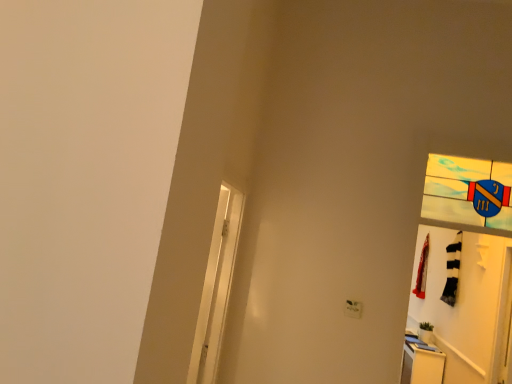
Question: Considering the positions of white plastic electric outlet at lower right and red fabric laundry at right in the image, is white plastic electric outlet at lower right taller or shorter than red fabric laundry at right?

Choices:
 (A) tall
 (B) short

Answer: (B)

Question: From the image's perspective, is white plastic electric outlet at lower right positioned above or below red fabric laundry at right?

Choices:
 (A) above
 (B) below

Answer: (A)

Question: Estimate the real-world distances between objects in this image. Which object is farther from the white matte door at right?

Choices:
 (A) red fabric laundry at right
 (B) stained glass shield at upper right
 (C) white plastic electric outlet at lower right
 (D) white glossy screen door at left
 (E) white glossy dresser at lower right

Answer: (D)

Question: Which object is positioned closest to the red fabric laundry at right?

Choices:
 (A) stained glass shield at upper right
 (B) white glossy dresser at lower right
 (C) white plastic electric outlet at lower right
 (D) white matte door at right
 (E) white glossy screen door at left

Answer: (D)